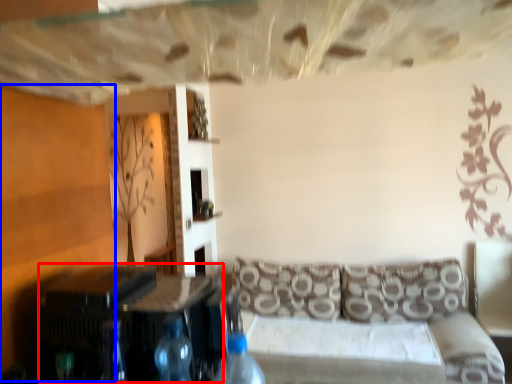
Question: Which object appears farthest to the camera in this image, table (highlighted by a red box) or plywood (highlighted by a blue box)?

Choices:
 (A) table
 (B) plywood

Answer: (B)